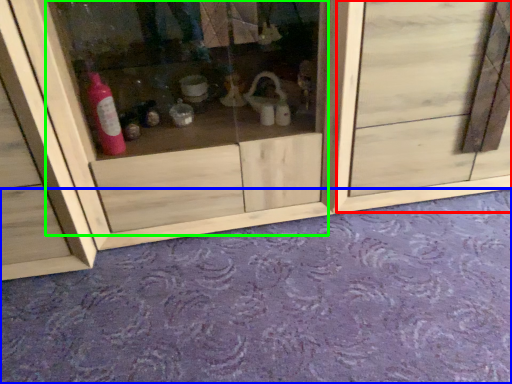
Question: Based on their relative distances, which object is nearer to door (highlighted by a red box)? Choose from plain (highlighted by a blue box) and glass door (highlighted by a green box).

Choices:
 (A) plain
 (B) glass door

Answer: (B)